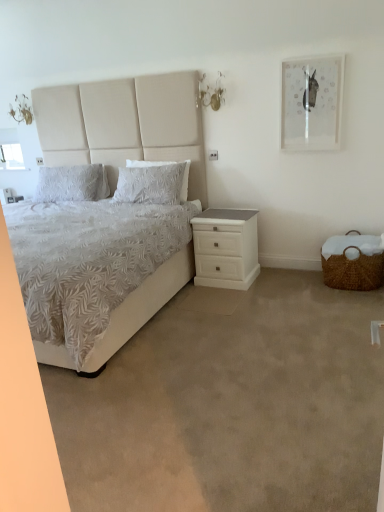
Question: Is the depth of beige carpet at lower center greater than that of white fabric bed at left?

Choices:
 (A) no
 (B) yes

Answer: (A)

Question: From a real-world perspective, is beige carpet at lower center located beneath white fabric bed at left?

Choices:
 (A) no
 (B) yes

Answer: (B)

Question: Does beige carpet at lower center have a greater width compared to white fabric bed at left?

Choices:
 (A) yes
 (B) no

Answer: (A)

Question: Is beige carpet at lower center taller than white fabric bed at left?

Choices:
 (A) no
 (B) yes

Answer: (A)

Question: Does beige carpet at lower center turn towards white fabric bed at left?

Choices:
 (A) yes
 (B) no

Answer: (B)

Question: Does beige carpet at lower center contain white fabric bed at left?

Choices:
 (A) yes
 (B) no

Answer: (B)

Question: Does matte white picture frame at upper right have a greater height compared to white textured pillow at upper left, the 1th pillow positioned from the left?

Choices:
 (A) no
 (B) yes

Answer: (B)

Question: Can you confirm if matte white picture frame at upper right is bigger than white textured pillow at upper left, the 1th pillow positioned from the left?

Choices:
 (A) yes
 (B) no

Answer: (B)

Question: Is matte white picture frame at upper right to the left of white textured pillow at upper left, the 1th pillow positioned from the left, from the viewer's perspective?

Choices:
 (A) no
 (B) yes

Answer: (A)

Question: From a real-world perspective, is matte white picture frame at upper right on white textured pillow at upper left, the 1th pillow positioned from the left?

Choices:
 (A) yes
 (B) no

Answer: (A)

Question: Is matte white picture frame at upper right positioned beyond the bounds of white textured pillow at upper left, the 1th pillow positioned from the left?

Choices:
 (A) yes
 (B) no

Answer: (A)

Question: Is matte white picture frame at upper right positioned with its back to white textured pillow at upper left, the 1th pillow positioned from the left?

Choices:
 (A) no
 (B) yes

Answer: (A)

Question: Considering the relative positions of white matte nightstand at lower right and white textured pillow at center, placed as the first pillow when sorted from right to left, in the image provided, is white matte nightstand at lower right to the right of white textured pillow at center, placed as the first pillow when sorted from right to left, from the viewer's perspective?

Choices:
 (A) no
 (B) yes

Answer: (B)